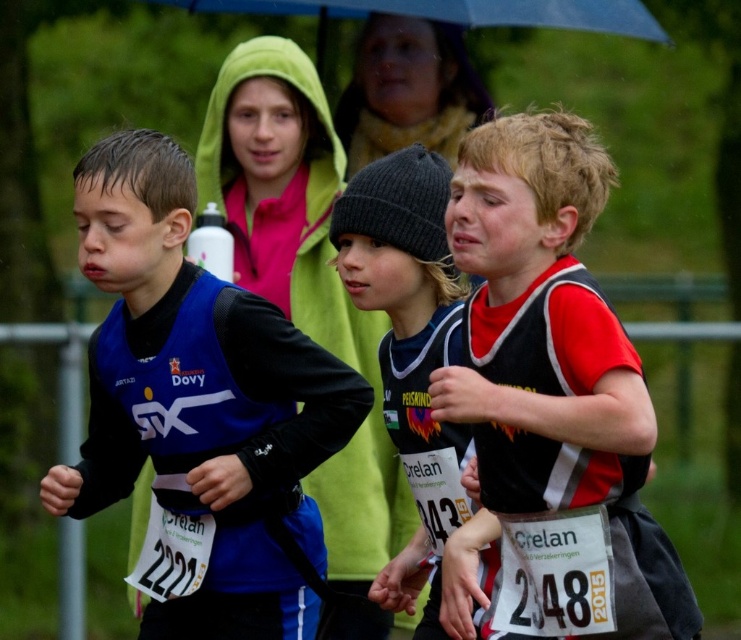
You are standing at the starting line of the race and see two points marked on the ground. The first point is at coordinates point [445,177] and the second point is at point [325,237]. Which point is closer to you?

Point [445,177] is closer to the camera than point [325,237], so the first point is closer to you.

You are a photographer at the event and need to capture a photo of the blue fabric jacket at center and the knit black beanie at center. Based on their positions, which one is lower in the image?

The knit black beanie at center is positioned under the blue fabric jacket at center, so the knit black beanie at center is lower in the image.